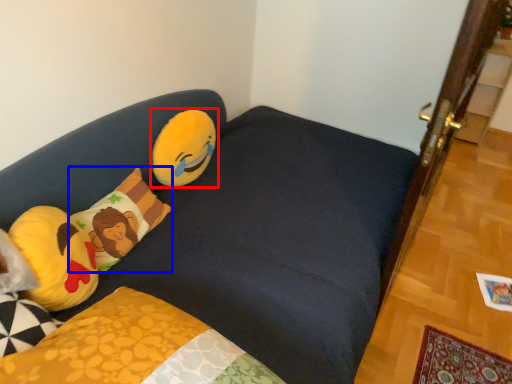
Question: Among these objects, which one is nearest to the camera, toy (highlighted by a red box) or pillow (highlighted by a blue box)?

Choices:
 (A) toy
 (B) pillow

Answer: (B)